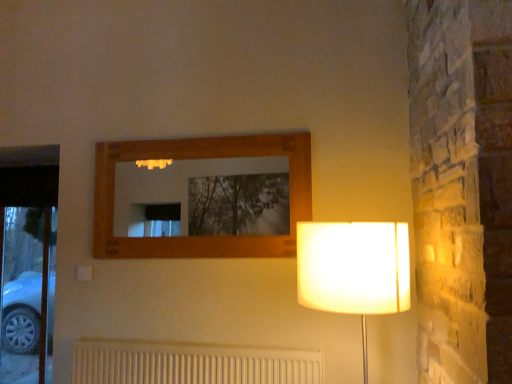
In order to face white fabric lampshade at right, should I rotate leftwards or rightwards?

You should rotate right by 12.834 degrees.

This screenshot has width=512, height=384. What do you see at coordinates (354, 269) in the screenshot?
I see `white fabric lampshade at right` at bounding box center [354, 269].

You are a GUI agent. You are given a task and a screenshot of the screen. Output one action in this format:
    pyautogui.click(x=<x>, y=<y>)
    Task: Click on the white fabric lampshade at right
    This screenshot has width=512, height=384.
    Given the screenshot: What is the action you would take?
    pyautogui.click(x=354, y=269)

What do you see at coordinates (190, 364) in the screenshot? I see `white textured radiator at lower center` at bounding box center [190, 364].

The height and width of the screenshot is (384, 512). I want to click on white textured radiator at lower center, so click(x=190, y=364).

From the picture: What is the approximate width of white textured radiator at lower center?

The width of white textured radiator at lower center is 4.89 inches.

At what (x,y) coordinates should I click in order to perform the action: click on white fabric lampshade at right. Please return your answer as a coordinate pair (x, y). This screenshot has width=512, height=384. Looking at the image, I should click on (354, 269).

Considering the relative positions of white textured radiator at lower center and white fabric lampshade at right in the image provided, is white textured radiator at lower center to the left or to the right of white fabric lampshade at right?

white textured radiator at lower center is to the left of white fabric lampshade at right.

Considering the positions of objects white textured radiator at lower center and white fabric lampshade at right in the image provided, who is behind, white textured radiator at lower center or white fabric lampshade at right?

white textured radiator at lower center is further from the camera.

Is point (162, 360) more distant than point (398, 241)?

Yes, point (162, 360) is farther from viewer.

From the image's perspective, which one is positioned higher, white textured radiator at lower center or white fabric lampshade at right?

From the image's view, white fabric lampshade at right is above.

From a real-world perspective, is white textured radiator at lower center positioned above or below white fabric lampshade at right?

Clearly, from a real-world perspective, white textured radiator at lower center is below white fabric lampshade at right.

Is white textured radiator at lower center wider than white fabric lampshade at right?

Incorrect, the width of white textured radiator at lower center does not surpass that of white fabric lampshade at right.

Considering the sizes of objects white textured radiator at lower center and white fabric lampshade at right in the image provided, who is taller, white textured radiator at lower center or white fabric lampshade at right?

white fabric lampshade at right is taller.

Considering the sizes of white textured radiator at lower center and white fabric lampshade at right in the image, is white textured radiator at lower center bigger or smaller than white fabric lampshade at right?

In the image, white textured radiator at lower center appears to be smaller than white fabric lampshade at right.

Is white textured radiator at lower center outside of white fabric lampshade at right?

Yes, white textured radiator at lower center is outside of white fabric lampshade at right.

Is white textured radiator at lower center directly adjacent to white fabric lampshade at right?

No, white textured radiator at lower center is not next to white fabric lampshade at right.

Looking at this image, could you tell me if white textured radiator at lower center is turned towards white fabric lampshade at right?

No, white textured radiator at lower center is not aimed at white fabric lampshade at right.

How different are the orientations of white textured radiator at lower center and white fabric lampshade at right in degrees?

white textured radiator at lower center and white fabric lampshade at right are facing 0.203 degrees away from each other.

Measure the distance from white textured radiator at lower center to white fabric lampshade at right.

86.38 centimeters.

The height and width of the screenshot is (384, 512). In the image, there is a white fabric lampshade at right. In order to click on radiator below it (from a real-world perspective) in this screenshot , I will do [190, 364].

Consider the image. Considering the relative positions of white fabric lampshade at right and white textured radiator at lower center in the image provided, is white fabric lampshade at right to the left or to the right of white textured radiator at lower center?

white fabric lampshade at right is to the right of white textured radiator at lower center.

Which object is further away from the camera taking this photo, white fabric lampshade at right or white textured radiator at lower center?

white textured radiator at lower center.

Considering the positions of point (398, 246) and point (197, 361), is point (398, 246) closer or farther from the camera than point (197, 361)?

Clearly, point (398, 246) is closer to the camera than point (197, 361).

From the picture: From the image's perspective, is white fabric lampshade at right located above or below white textured radiator at lower center?

Based on their image positions, white fabric lampshade at right is located above white textured radiator at lower center.

From a real-world perspective, is white fabric lampshade at right on top of white textured radiator at lower center?

Yes, from a real-world perspective, white fabric lampshade at right is over white textured radiator at lower center

In terms of width, does white fabric lampshade at right look wider or thinner when compared to white textured radiator at lower center?

In the image, white fabric lampshade at right appears to be wider than white textured radiator at lower center.

Can you confirm if white fabric lampshade at right is taller than white textured radiator at lower center?

Yes.

Considering the relative sizes of white fabric lampshade at right and white textured radiator at lower center in the image provided, is white fabric lampshade at right smaller than white textured radiator at lower center?

No, white fabric lampshade at right is not smaller than white textured radiator at lower center.

From the picture: Is white fabric lampshade at right inside or outside of white textured radiator at lower center?

white fabric lampshade at right cannot be found inside white textured radiator at lower center.

Is white fabric lampshade at right not near white textured radiator at lower center?

No, white fabric lampshade at right is not far from white textured radiator at lower center.

Is white fabric lampshade at right looking in the opposite direction of white textured radiator at lower center?

No.

This screenshot has height=384, width=512. I want to click on lamp above the white textured radiator at lower center (from a real-world perspective), so click(x=354, y=269).

In the image, there is a white fabric lampshade at right. Where is `radiator below it (from the image's perspective)`? This screenshot has height=384, width=512. radiator below it (from the image's perspective) is located at coordinates (190, 364).

The height and width of the screenshot is (384, 512). What are the coordinates of `lamp above the white textured radiator at lower center (from the image's perspective)` in the screenshot? It's located at (354, 269).